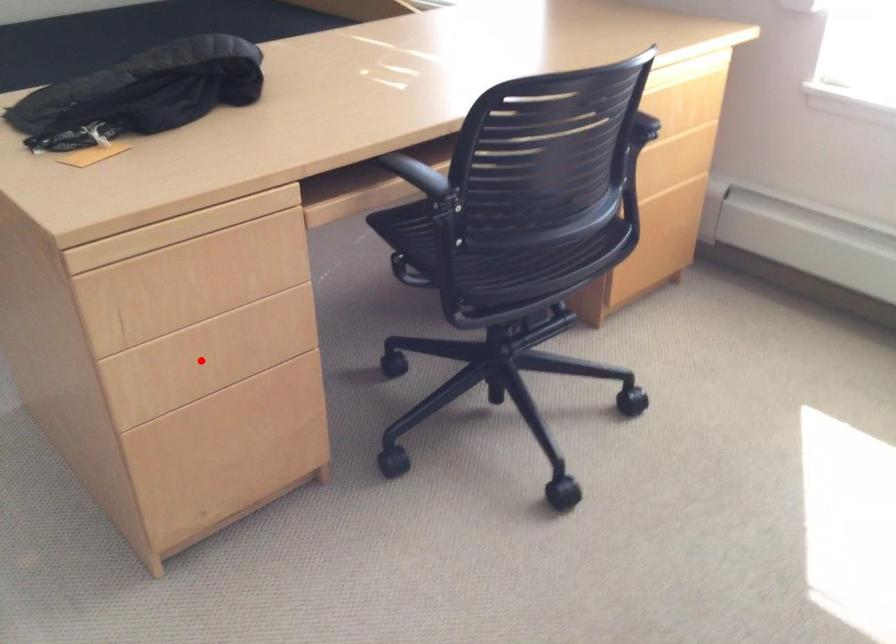
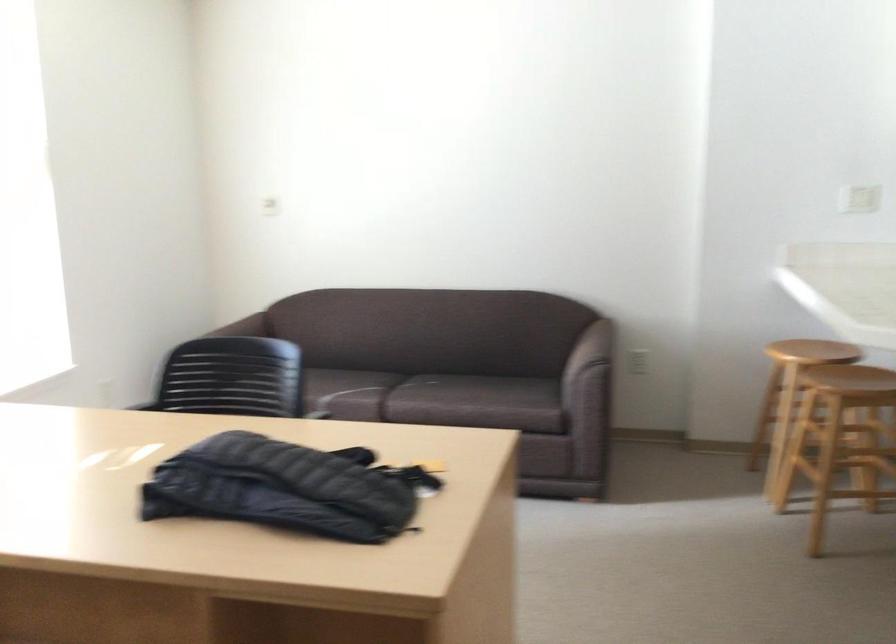
Question: I am providing you with two images of the same scene from different viewpoints. A red point is marked on the first image. Is the red point's position out of view in image 2?

Choices:
 (A) Yes
 (B) No

Answer: (A)